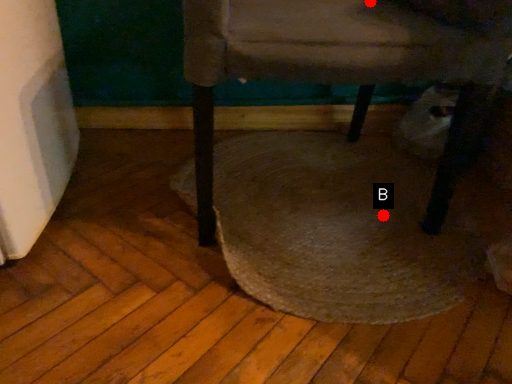
Question: Two points are circled on the image, labeled by A and B beside each circle. Which of the following is the farthest from the observer?

Choices:
 (A) A is further
 (B) B is further

Answer: (B)